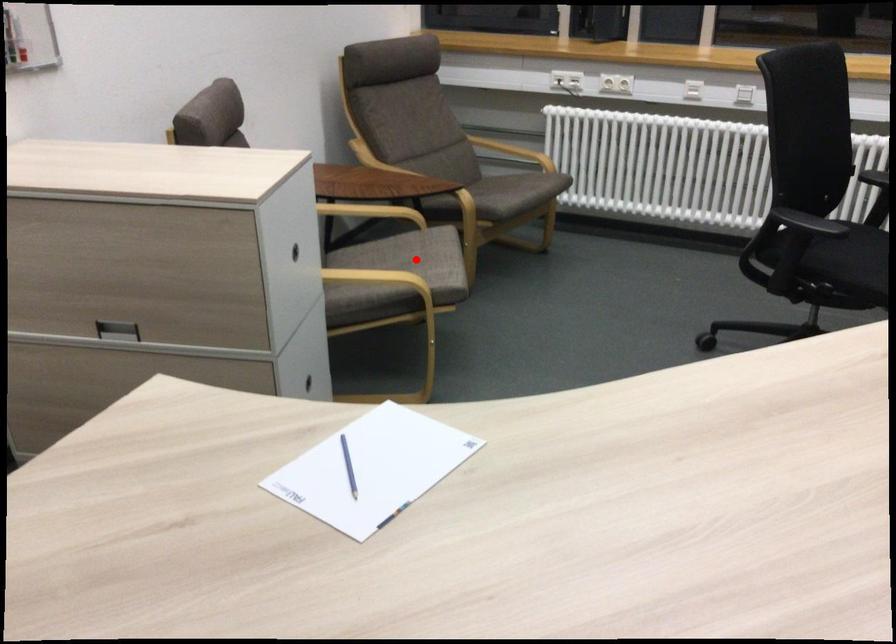
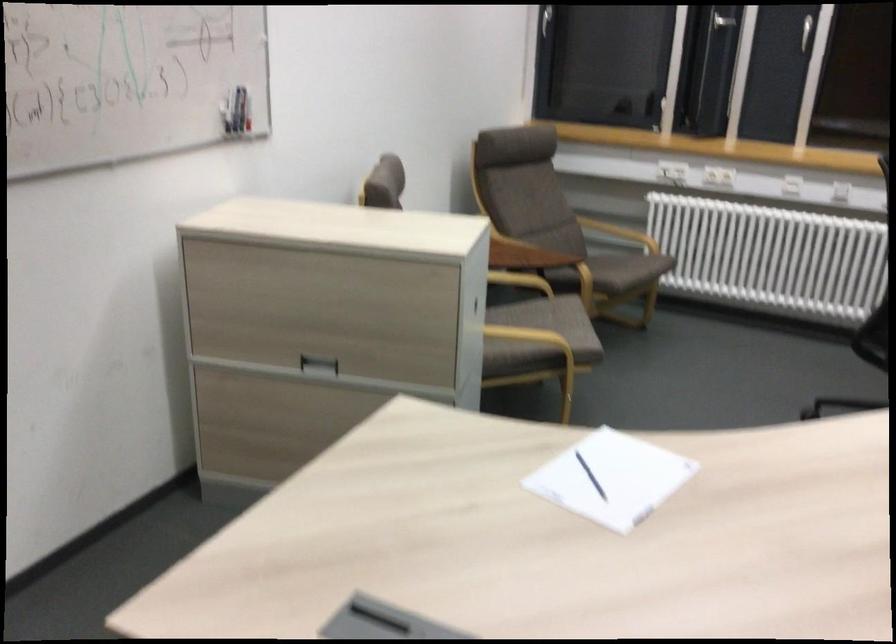
The point at the highlighted location is marked in the first image. Where is the corresponding point in the second image?

(552, 321)